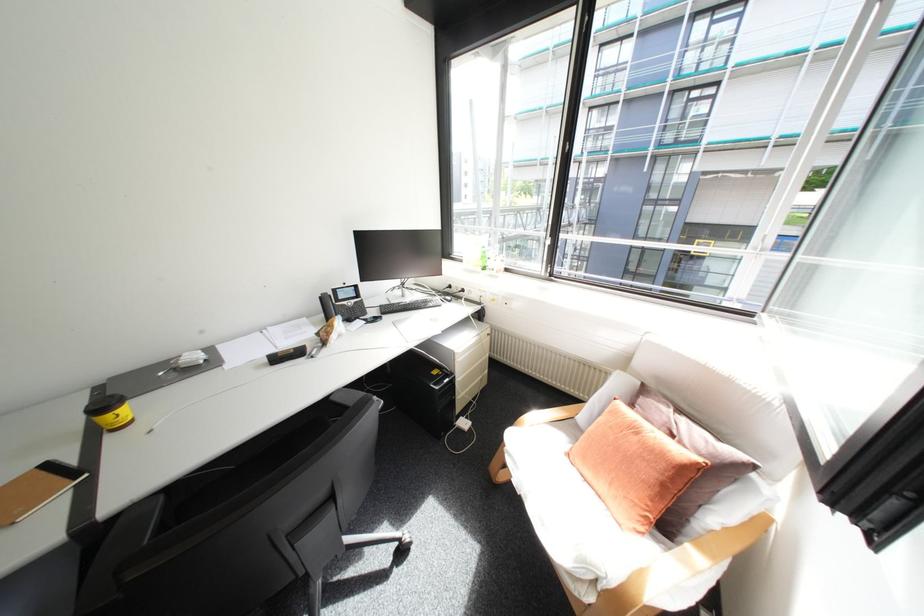
What do you see at coordinates (618, 464) in the screenshot? I see `a chair sitting surface` at bounding box center [618, 464].